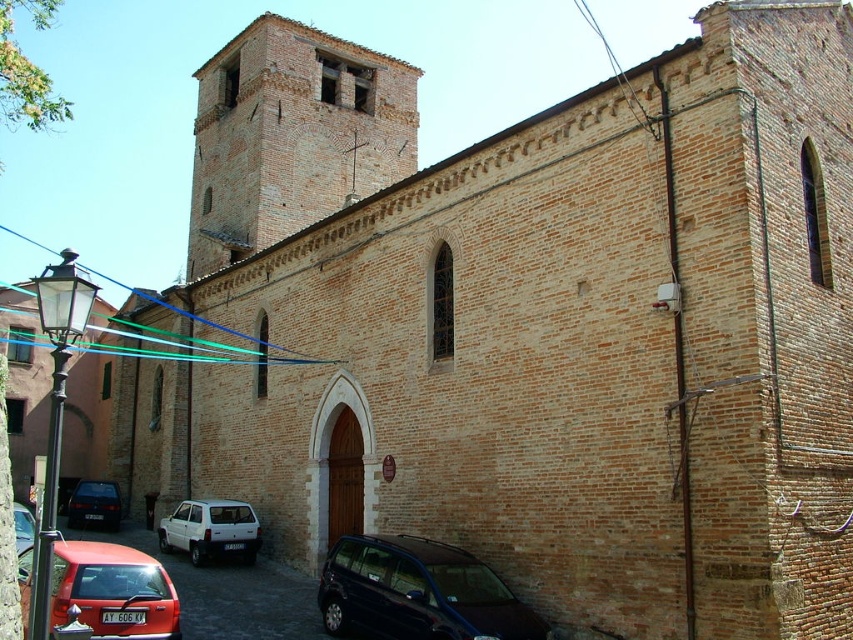
Who is more distant from viewer, (155, 572) or (83, 490)?

Positioned behind is point (83, 490).

Who is lower down, matte red hatchback at lower left or matte black car at lower left?

matte black car at lower left is lower down.

Is point (165, 609) farther from viewer compared to point (96, 500)?

No, (165, 609) is in front of (96, 500).

I want to click on matte red hatchback at lower left, so click(113, 592).

Is matte red hatchback at lower left wider than matte red car at lower left?

No, matte red hatchback at lower left is not wider than matte red car at lower left.

Is matte red hatchback at lower left further to the viewer compared to matte red car at lower left?

That is False.

This screenshot has width=853, height=640. Identify the location of matte red hatchback at lower left. (113, 592).

Does white matte hatchback at lower left appear over matte red car at lower left?

No.

Who is positioned more to the left, white matte hatchback at lower left or matte red car at lower left?

matte red car at lower left

Describe the element at coordinates (212, 531) in the screenshot. This screenshot has width=853, height=640. I see `white matte hatchback at lower left` at that location.

Where is `white matte hatchback at lower left`? Image resolution: width=853 pixels, height=640 pixels. white matte hatchback at lower left is located at coordinates (212, 531).